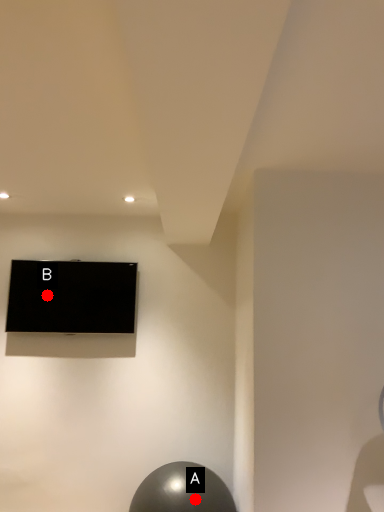
Question: Two points are circled on the image, labeled by A and B beside each circle. Which of the following is the farthest from the observer?

Choices:
 (A) A is further
 (B) B is further

Answer: (B)